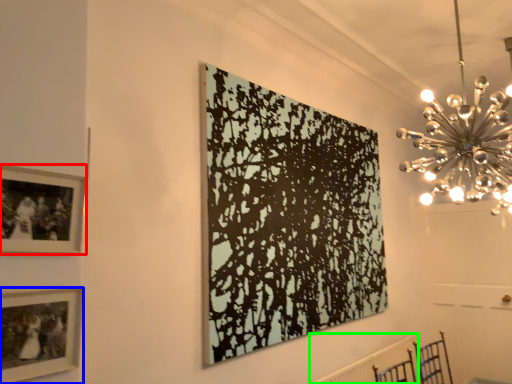
Question: Which is farther away from picture frame (highlighted by a red box)? picture frame (highlighted by a blue box) or radiator (highlighted by a green box)?

Choices:
 (A) picture frame
 (B) radiator

Answer: (B)